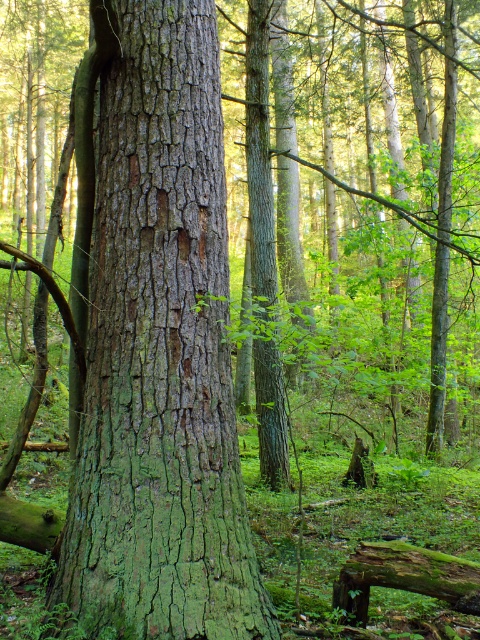
Can you confirm if green rough bark tree trunk at center is taller than green mossy log at lower right?

Correct, green rough bark tree trunk at center is much taller as green mossy log at lower right.

The height and width of the screenshot is (640, 480). In order to click on green rough bark tree trunk at center in this screenshot , I will do `click(159, 356)`.